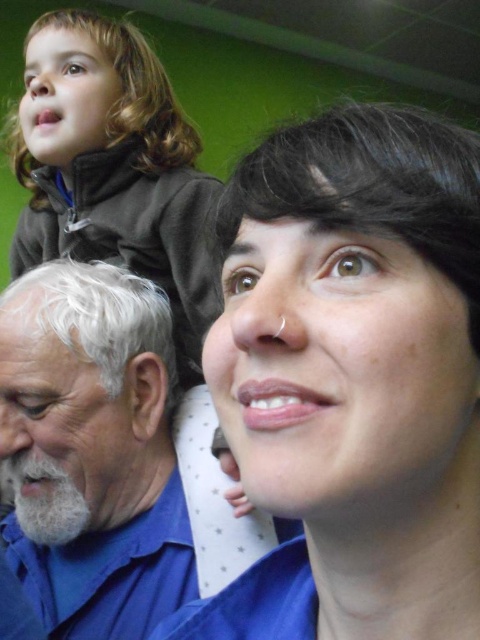
From the picture: Who is lower down, matte blue shirt at center or dark brown fleece at upper left?

matte blue shirt at center

Is matte blue shirt at center to the right of dark brown fleece at upper left from the viewer's perspective?

Indeed, matte blue shirt at center is positioned on the right side of dark brown fleece at upper left.

Measure the distance between point (320, 410) and camera.

Point (320, 410) and camera are 10.41 inches apart.

Identify the location of matte blue shirt at center. (x=352, y=378).

Based on the photo, does gray beard at left lie behind dark brown fleece at upper left?

Yes, it is behind dark brown fleece at upper left.

Based on the photo, is gray beard at left above dark brown fleece at upper left?

Incorrect, gray beard at left is not positioned above dark brown fleece at upper left.

Does point (10, 316) lie behind point (69, 108)?

No, (10, 316) is in front of (69, 108).

You are a GUI agent. You are given a task and a screenshot of the screen. Output one action in this format:
    pyautogui.click(x=<x>, y=<y>)
    Task: Click on the gray beard at left
    
    Given the screenshot: What is the action you would take?
    pyautogui.click(x=98, y=451)

Is matte blue shirt at center wider than gray beard at left?

No.

Is matte blue shirt at center smaller than gray beard at left?

Correct, matte blue shirt at center occupies less space than gray beard at left.

Which is behind, point (352, 300) or point (162, 472)?

Point (162, 472)

Locate an element on the screen. matte blue shirt at center is located at coordinates (352, 378).